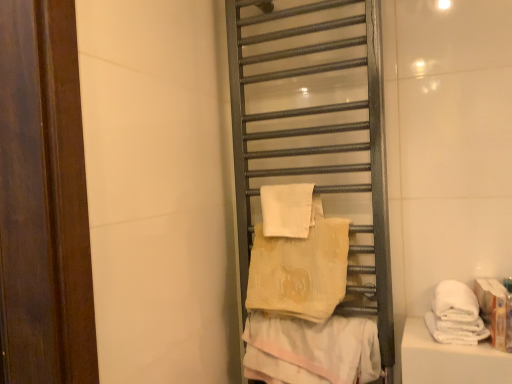
Locate an element on the screen. white soft towel at center, acting as the fourth towel starting from the bottom is located at coordinates (287, 210).

Where is `white soft towel at right, arranged as the second towel when ordered from the bottom`? Image resolution: width=512 pixels, height=384 pixels. white soft towel at right, arranged as the second towel when ordered from the bottom is located at coordinates (455, 315).

I want to click on beige textured towel at center, the 4th towel viewed from the top, so click(x=311, y=350).

Relative to white soft towel at center, acting as the fourth towel starting from the bottom, is beige soft towel at center, acting as the second towel starting from the top, in front or behind?

In the image, beige soft towel at center, acting as the second towel starting from the top, appears in front of white soft towel at center, acting as the fourth towel starting from the bottom.

Which is more to the left, beige soft towel at center, positioned as the third towel in bottom-to-top order, or white soft towel at center, acting as the fourth towel starting from the bottom?

white soft towel at center, acting as the fourth towel starting from the bottom.

Is beige soft towel at center, acting as the second towel starting from the top, oriented towards white soft towel at center, acting as the fourth towel starting from the bottom?

No.

Considering the positions of objects beige textured towel at center, arranged as the 1th towel when ordered from the bottom, and metallic towel rack at center in the image provided, who is in front, beige textured towel at center, arranged as the 1th towel when ordered from the bottom, or metallic towel rack at center?

Positioned in front is metallic towel rack at center.

From the image's perspective, is beige textured towel at center, the 4th towel viewed from the top, on metallic towel rack at center?

No, from the image's perspective, beige textured towel at center, the 4th towel viewed from the top, is not on top of metallic towel rack at center.

Who is shorter, beige textured towel at center, the 4th towel viewed from the top, or metallic towel rack at center?

Standing shorter between the two is beige textured towel at center, the 4th towel viewed from the top.

Which is more to the left, beige textured towel at center, arranged as the 1th towel when ordered from the bottom, or metallic towel rack at center?

beige textured towel at center, arranged as the 1th towel when ordered from the bottom, is more to the left.

Does white soft towel at right, arranged as the second towel when ordered from the bottom, appear on the right side of beige textured towel at center, arranged as the 1th towel when ordered from the bottom?

Indeed, white soft towel at right, arranged as the second towel when ordered from the bottom, is positioned on the right side of beige textured towel at center, arranged as the 1th towel when ordered from the bottom.

From a real-world perspective, between white soft towel at right, arranged as the second towel when ordered from the bottom, and beige textured towel at center, arranged as the 1th towel when ordered from the bottom, who is vertically lower?

beige textured towel at center, arranged as the 1th towel when ordered from the bottom, from a real-world perspective.

Is white soft towel at right, arranged as the second towel when ordered from the bottom, oriented away from beige textured towel at center, arranged as the 1th towel when ordered from the bottom?

No, white soft towel at right, arranged as the second towel when ordered from the bottom,'s orientation is not away from beige textured towel at center, arranged as the 1th towel when ordered from the bottom.

The width and height of the screenshot is (512, 384). I want to click on towel that appears below the white soft towel at right, which appears as the third towel when viewed from the top (from a real-world perspective), so click(x=311, y=350).

From the image's perspective, is white soft towel at right, arranged as the second towel when ordered from the bottom, on top of beige soft towel at center, positioned as the third towel in bottom-to-top order?

No, from the image's perspective, white soft towel at right, arranged as the second towel when ordered from the bottom, is not above beige soft towel at center, positioned as the third towel in bottom-to-top order.

Which is more to the left, white soft towel at right, arranged as the second towel when ordered from the bottom, or beige soft towel at center, acting as the second towel starting from the top?

beige soft towel at center, acting as the second towel starting from the top.

Consider the image. Is white soft towel at right, arranged as the second towel when ordered from the bottom, completely or partially outside of beige soft towel at center, acting as the second towel starting from the top?

Indeed, white soft towel at right, arranged as the second towel when ordered from the bottom, is completely outside beige soft towel at center, acting as the second towel starting from the top.

Considering the sizes of white soft towel at right, arranged as the second towel when ordered from the bottom, and beige soft towel at center, positioned as the third towel in bottom-to-top order, in the image, is white soft towel at right, arranged as the second towel when ordered from the bottom, wider or thinner than beige soft towel at center, positioned as the third towel in bottom-to-top order,?

Clearly, white soft towel at right, arranged as the second towel when ordered from the bottom, has more width compared to beige soft towel at center, positioned as the third towel in bottom-to-top order.

Considering the positions of points (346, 127) and (283, 306), is point (346, 127) farther from camera compared to point (283, 306)?

Yes, point (346, 127) is farther from viewer.

Can you confirm if metallic towel rack at center is taller than beige soft towel at center, positioned as the third towel in bottom-to-top order?

Indeed, metallic towel rack at center has a greater height compared to beige soft towel at center, positioned as the third towel in bottom-to-top order.

Can you confirm if metallic towel rack at center is positioned to the right of beige soft towel at center, positioned as the third towel in bottom-to-top order?

Yes.

Is metallic towel rack at center inside or outside of beige soft towel at center, positioned as the third towel in bottom-to-top order?

metallic towel rack at center is outside beige soft towel at center, positioned as the third towel in bottom-to-top order.

In the scene shown: Visually, is white soft towel at center, arranged as the first towel when viewed from the top, positioned to the left or to the right of white soft towel at right, arranged as the second towel when ordered from the bottom?

From the image, it's evident that white soft towel at center, arranged as the first towel when viewed from the top, is to the left of white soft towel at right, arranged as the second towel when ordered from the bottom.

Considering the relative sizes of white soft towel at center, acting as the fourth towel starting from the bottom, and white soft towel at right, which appears as the third towel when viewed from the top, in the image provided, is white soft towel at center, acting as the fourth towel starting from the bottom, taller than white soft towel at right, which appears as the third towel when viewed from the top,?

Yes, white soft towel at center, acting as the fourth towel starting from the bottom, is taller than white soft towel at right, which appears as the third towel when viewed from the top.

Is white soft towel at right, arranged as the second towel when ordered from the bottom, completely or partially inside white soft towel at center, acting as the fourth towel starting from the bottom?

No, white soft towel at right, arranged as the second towel when ordered from the bottom, is not a part of white soft towel at center, acting as the fourth towel starting from the bottom.

From a real-world perspective, is white soft towel at center, arranged as the first towel when viewed from the top, positioned over white soft towel at right, arranged as the second towel when ordered from the bottom, based on gravity?

Yes, from a real-world perspective, white soft towel at center, arranged as the first towel when viewed from the top, is above white soft towel at right, arranged as the second towel when ordered from the bottom.

What's the angular difference between beige soft towel at center, acting as the second towel starting from the top, and white soft towel at right, arranged as the second towel when ordered from the bottom,'s facing directions?

There is a 1.52-degree angle between the facing directions of beige soft towel at center, acting as the second towel starting from the top, and white soft towel at right, arranged as the second towel when ordered from the bottom.

Considering the sizes of objects beige soft towel at center, positioned as the third towel in bottom-to-top order, and white soft towel at right, which appears as the third towel when viewed from the top, in the image provided, who is taller, beige soft towel at center, positioned as the third towel in bottom-to-top order, or white soft towel at right, which appears as the third towel when viewed from the top,?

With more height is beige soft towel at center, positioned as the third towel in bottom-to-top order.

Could you tell me if beige soft towel at center, positioned as the third towel in bottom-to-top order, is facing white soft towel at right, which appears as the third towel when viewed from the top?

No, beige soft towel at center, positioned as the third towel in bottom-to-top order, is not turned towards white soft towel at right, which appears as the third towel when viewed from the top.

You are a GUI agent. You are given a task and a screenshot of the screen. Output one action in this format:
    pyautogui.click(x=<x>, y=<y>)
    Task: Click on the towel that is the 2nd object to the left of the white soft towel at right, arranged as the second towel when ordered from the bottom, starting at the anchor
    The image size is (512, 384).
    Given the screenshot: What is the action you would take?
    pyautogui.click(x=300, y=271)

Which towel is the 1st one when counting from the front of the white soft towel at center, acting as the fourth towel starting from the bottom? Please provide its 2D coordinates.

[(300, 271)]

This screenshot has height=384, width=512. Find the location of `shelf located above the beige textured towel at center, arranged as the 1th towel when ordered from the bottom (from a real-world perspective)`. shelf located above the beige textured towel at center, arranged as the 1th towel when ordered from the bottom (from a real-world perspective) is located at coordinates (314, 134).

Looking at the image, which one is located closer to white soft towel at center, arranged as the first towel when viewed from the top, beige textured towel at center, the 4th towel viewed from the top, or white soft towel at right, which appears as the third towel when viewed from the top?

beige textured towel at center, the 4th towel viewed from the top, is closer to white soft towel at center, arranged as the first towel when viewed from the top.

Based on their spatial positions, is metallic towel rack at center or white soft towel at right, arranged as the second towel when ordered from the bottom, closer to beige textured towel at center, the 4th towel viewed from the top?

white soft towel at right, arranged as the second towel when ordered from the bottom, is positioned closer to the anchor beige textured towel at center, the 4th towel viewed from the top.

Considering their positions, is beige textured towel at center, arranged as the 1th towel when ordered from the bottom, positioned further to white soft towel at right, which appears as the third towel when viewed from the top, than white soft towel at center, acting as the fourth towel starting from the bottom?

white soft towel at center, acting as the fourth towel starting from the bottom, lies further to white soft towel at right, which appears as the third towel when viewed from the top, than the other object.

Based on their spatial positions, is white soft towel at right, which appears as the third towel when viewed from the top, or beige soft towel at center, acting as the second towel starting from the top, closer to white soft towel at center, arranged as the first towel when viewed from the top?

Based on the image, beige soft towel at center, acting as the second towel starting from the top, appears to be nearer to white soft towel at center, arranged as the first towel when viewed from the top.

From the image, which object appears to be nearer to white soft towel at center, arranged as the first towel when viewed from the top, beige textured towel at center, the 4th towel viewed from the top, or metallic towel rack at center?

metallic towel rack at center lies closer to white soft towel at center, arranged as the first towel when viewed from the top, than the other object.

When comparing their distances from beige soft towel at center, acting as the second towel starting from the top, does metallic towel rack at center or white soft towel at right, which appears as the third towel when viewed from the top, seem closer?

metallic towel rack at center lies closer to beige soft towel at center, acting as the second towel starting from the top, than the other object.

Looking at the image, which one is located closer to beige soft towel at center, acting as the second towel starting from the top, white soft towel at center, acting as the fourth towel starting from the bottom, or white soft towel at right, arranged as the second towel when ordered from the bottom?

The object closer to beige soft towel at center, acting as the second towel starting from the top, is white soft towel at center, acting as the fourth towel starting from the bottom.

From the image, which object appears to be farther from white soft towel at center, arranged as the first towel when viewed from the top, metallic towel rack at center or beige textured towel at center, the 4th towel viewed from the top?

beige textured towel at center, the 4th towel viewed from the top.

You are a GUI agent. You are given a task and a screenshot of the screen. Output one action in this format:
    pyautogui.click(x=<x>, y=<y>)
    Task: Click on the towel situated between beige soft towel at center, positioned as the third towel in bottom-to-top order, and white soft towel at right, which appears as the third towel when viewed from the top, from left to right
    
    Given the screenshot: What is the action you would take?
    pyautogui.click(x=311, y=350)

The width and height of the screenshot is (512, 384). Find the location of `shelf between white soft towel at center, acting as the fourth towel starting from the bottom, and white soft towel at right, arranged as the second towel when ordered from the bottom, from left to right`. shelf between white soft towel at center, acting as the fourth towel starting from the bottom, and white soft towel at right, arranged as the second towel when ordered from the bottom, from left to right is located at coordinates (314, 134).

You are a GUI agent. You are given a task and a screenshot of the screen. Output one action in this format:
    pyautogui.click(x=<x>, y=<y>)
    Task: Click on the shelf between beige soft towel at center, acting as the second towel starting from the top, and white soft towel at right, which appears as the third towel when viewed from the top, in the horizontal direction
    The height and width of the screenshot is (384, 512).
    Given the screenshot: What is the action you would take?
    pyautogui.click(x=314, y=134)

Identify the location of towel between metallic towel rack at center and beige soft towel at center, positioned as the third towel in bottom-to-top order, in the up-down direction. (287, 210).